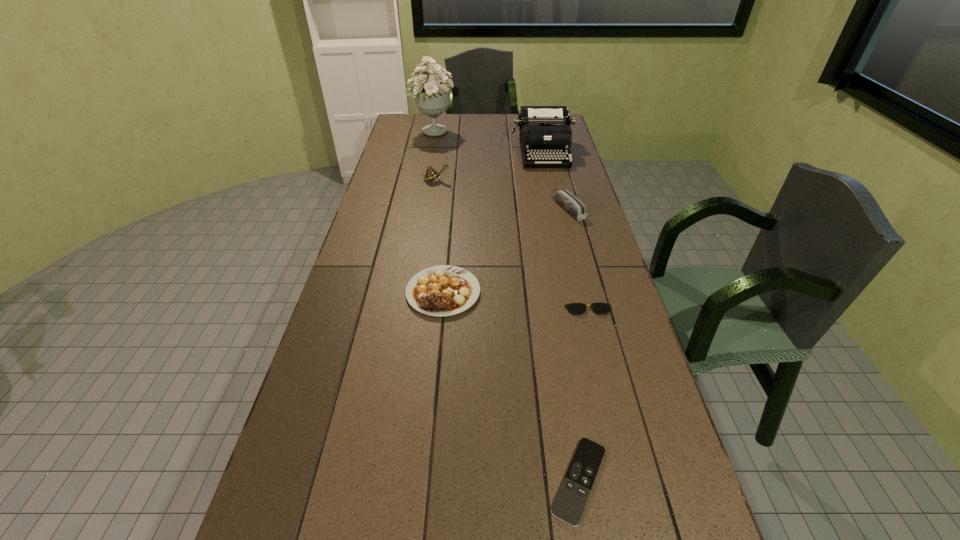
Locate an element on the screen. This screenshot has height=540, width=960. vacant area that satisfies the following two spatial constraints: 1. on the front side of the tallest object; 2. on the left side of the fifth tallest object is located at coordinates (403, 292).

The width and height of the screenshot is (960, 540). What are the coordinates of `vacant region that satisfies the following two spatial constraints: 1. on the typing side of the typewriter; 2. on the face of the snail` in the screenshot? It's located at (548, 180).

Where is `vacant area in the image that satisfies the following two spatial constraints: 1. on the face of the fifth shortest object; 2. on the left side of the pencil box`? This screenshot has height=540, width=960. vacant area in the image that satisfies the following two spatial constraints: 1. on the face of the fifth shortest object; 2. on the left side of the pencil box is located at coordinates (433, 208).